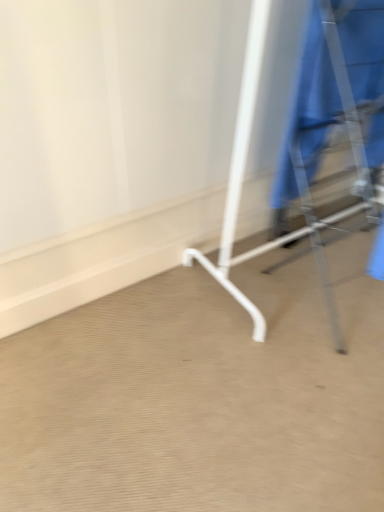
Question: Is metallic silver coat rack at right not within blue fabric robe at right?

Choices:
 (A) yes
 (B) no

Answer: (A)

Question: Is metallic silver coat rack at right to the left of blue fabric robe at right from the viewer's perspective?

Choices:
 (A) yes
 (B) no

Answer: (B)

Question: Is metallic silver coat rack at right taller than blue fabric robe at right?

Choices:
 (A) no
 (B) yes

Answer: (B)

Question: Does metallic silver coat rack at right have a lesser height compared to blue fabric robe at right?

Choices:
 (A) yes
 (B) no

Answer: (B)

Question: Is metallic silver coat rack at right to the right of blue fabric robe at right from the viewer's perspective?

Choices:
 (A) yes
 (B) no

Answer: (A)

Question: Does metallic silver coat rack at right turn towards blue fabric robe at right?

Choices:
 (A) yes
 (B) no

Answer: (B)

Question: Would you say blue fabric robe at right is outside metallic silver coat rack at right?

Choices:
 (A) yes
 (B) no

Answer: (B)

Question: Can you confirm if blue fabric robe at right is smaller than metallic silver coat rack at right?

Choices:
 (A) no
 (B) yes

Answer: (B)

Question: From a real-world perspective, is blue fabric robe at right located higher than metallic silver coat rack at right?

Choices:
 (A) yes
 (B) no

Answer: (A)

Question: From the image's perspective, is blue fabric robe at right on metallic silver coat rack at right?

Choices:
 (A) no
 (B) yes

Answer: (B)

Question: Would you say blue fabric robe at right is a long distance from metallic silver coat rack at right?

Choices:
 (A) no
 (B) yes

Answer: (A)

Question: Considering the relative sizes of blue fabric robe at right and metallic silver coat rack at right in the image provided, is blue fabric robe at right wider than metallic silver coat rack at right?

Choices:
 (A) no
 (B) yes

Answer: (A)

Question: From a real-world perspective, is metallic silver coat rack at right above or below blue fabric robe at right?

Choices:
 (A) below
 (B) above

Answer: (A)